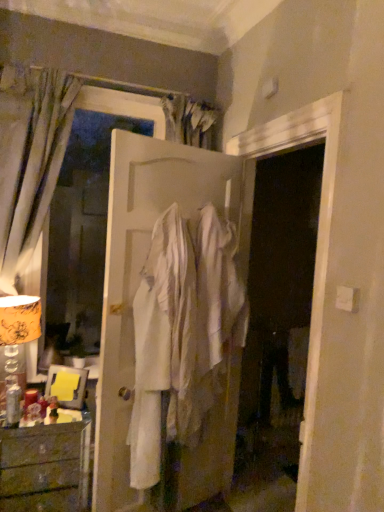
Question: From a real-world perspective, is silky gray curtain at left over gold-patterned fabric lampshade at left?

Choices:
 (A) yes
 (B) no

Answer: (A)

Question: Considering the relative positions of silky gray curtain at left and gold-patterned fabric lampshade at left in the image provided, is silky gray curtain at left to the right of gold-patterned fabric lampshade at left from the viewer's perspective?

Choices:
 (A) yes
 (B) no

Answer: (A)

Question: Is silky gray curtain at left in contact with gold-patterned fabric lampshade at left?

Choices:
 (A) yes
 (B) no

Answer: (B)

Question: Does silky gray curtain at left have a lesser width compared to gold-patterned fabric lampshade at left?

Choices:
 (A) no
 (B) yes

Answer: (B)

Question: Is silky gray curtain at left turned away from gold-patterned fabric lampshade at left?

Choices:
 (A) yes
 (B) no

Answer: (A)

Question: From the image's perspective, is silky gray curtain at left positioned above or below wooden chest of drawers at lower left?

Choices:
 (A) above
 (B) below

Answer: (A)

Question: Is point (46, 70) positioned closer to the camera than point (21, 487)?

Choices:
 (A) farther
 (B) closer

Answer: (B)

Question: In terms of size, does silky gray curtain at left appear bigger or smaller than wooden chest of drawers at lower left?

Choices:
 (A) big
 (B) small

Answer: (A)

Question: In the image, is silky gray curtain at left on the left side or the right side of wooden chest of drawers at lower left?

Choices:
 (A) left
 (B) right

Answer: (A)

Question: In terms of width, does silky gray curtain at left look wider or thinner when compared to white matte door at center?

Choices:
 (A) thin
 (B) wide

Answer: (B)

Question: Relative to white matte door at center, is silky gray curtain at left in front or behind?

Choices:
 (A) front
 (B) behind

Answer: (B)

Question: Is silky gray curtain at left bigger or smaller than white matte door at center?

Choices:
 (A) small
 (B) big

Answer: (A)

Question: Is silky gray curtain at left inside or outside of white matte door at center?

Choices:
 (A) outside
 (B) inside

Answer: (A)

Question: Is wooden chest of drawers at lower left in front of or behind gold-patterned fabric lampshade at left in the image?

Choices:
 (A) behind
 (B) front

Answer: (B)

Question: Looking at their shapes, would you say wooden chest of drawers at lower left is wider or thinner than gold-patterned fabric lampshade at left?

Choices:
 (A) wide
 (B) thin

Answer: (A)